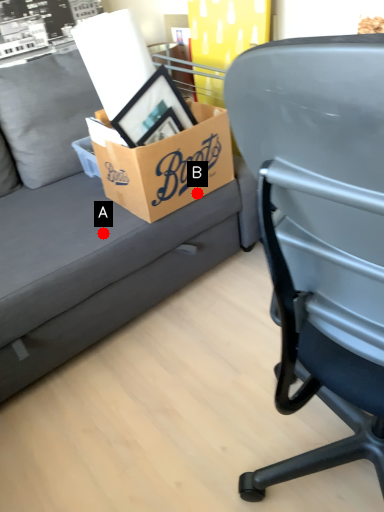
Question: Two points are circled on the image, labeled by A and B beside each circle. Which point is further to the camera?

Choices:
 (A) A is further
 (B) B is further

Answer: (B)